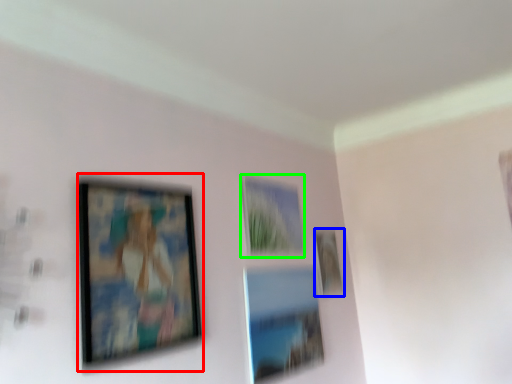
Question: Which object is positioned closest to picture frame (highlighted by a red box)? Select from picture frame (highlighted by a blue box) and picture frame (highlighted by a green box).

Choices:
 (A) picture frame
 (B) picture frame

Answer: (B)